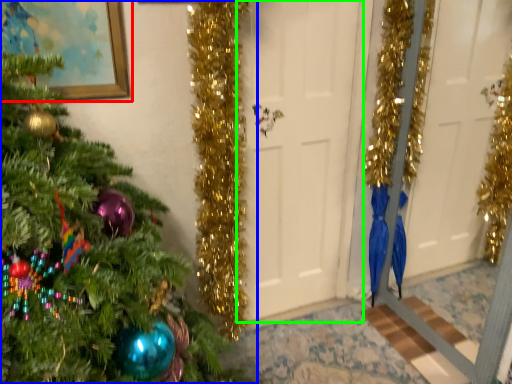
Question: Considering the real-world distances, which object is farthest from picture frame (highlighted by a red box)? christmas tree (highlighted by a blue box) or door (highlighted by a green box)?

Choices:
 (A) christmas tree
 (B) door

Answer: (B)